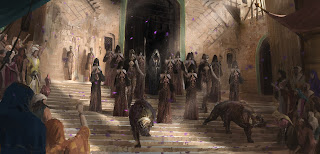
Locate an element on the screen. The image size is (320, 154). bottom stair visible is located at coordinates (270, 151).